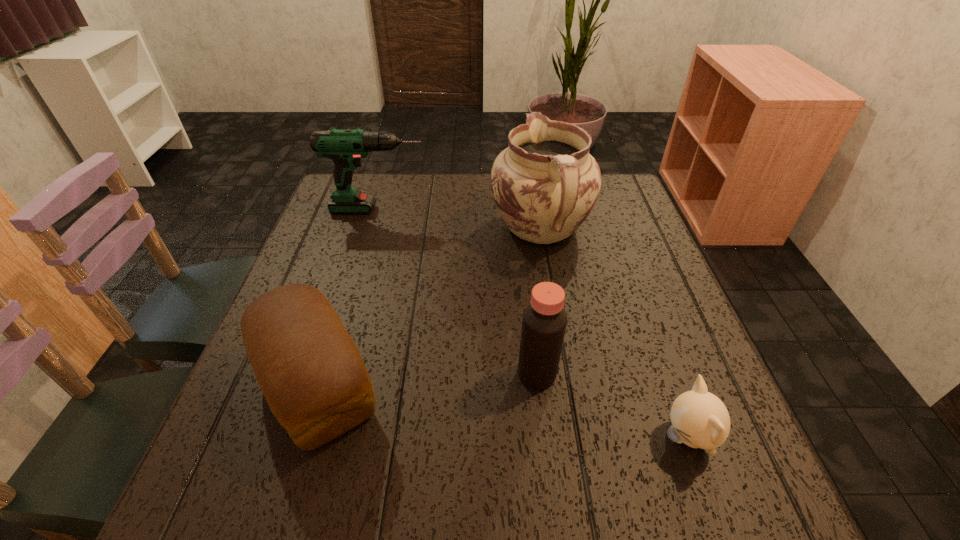
The width and height of the screenshot is (960, 540). I want to click on pitcher, so click(545, 184).

You are a GUI agent. You are given a task and a screenshot of the screen. Output one action in this format:
    pyautogui.click(x=<x>, y=<y>)
    Task: Click on the drill
    The image size is (960, 540).
    Given the screenshot: What is the action you would take?
    pyautogui.click(x=346, y=147)

I want to click on vinegar, so click(x=544, y=321).

You are a GUI agent. You are given a task and a screenshot of the screen. Output one action in this format:
    pyautogui.click(x=<x>, y=<y>)
    Task: Click on the bread
    
    Given the screenshot: What is the action you would take?
    pyautogui.click(x=310, y=371)

You are a GUI agent. You are given a task and a screenshot of the screen. Output one action in this format:
    pyautogui.click(x=<x>, y=<y>)
    Task: Click on the kitten
    The width and height of the screenshot is (960, 540).
    Given the screenshot: What is the action you would take?
    pyautogui.click(x=699, y=419)

The image size is (960, 540). Identify the location of the rightmost object. (699, 419).

Identify the location of vacant area situated on the spout of the pitcher. (533, 180).

Where is `free space located 0.060m on the handle side of the drill`? The image size is (960, 540). free space located 0.060m on the handle side of the drill is located at coordinates (448, 210).

At what (x,y) coordinates should I click in order to perform the action: click on free spot located on the left of the vinegar. Please return your answer as a coordinate pair (x, y). Looking at the image, I should click on (367, 374).

Identify the location of vacant area located on the right of the second shortest object. (594, 384).